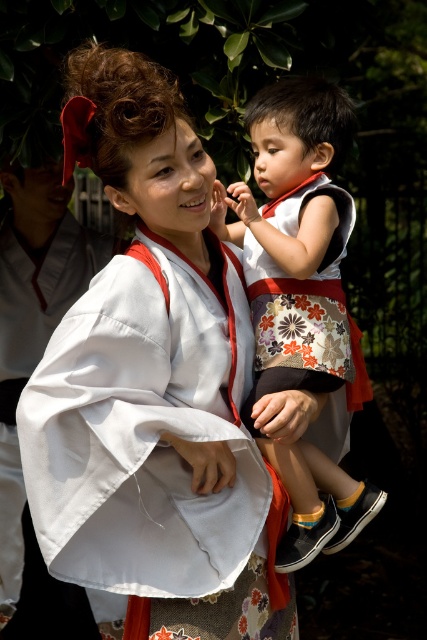
Does white silk kimono at center have a lesser width compared to white satin kimono at center?

No, white silk kimono at center is not thinner than white satin kimono at center.

Can you confirm if white silk kimono at center is wider than white satin kimono at center?

Indeed, white silk kimono at center has a greater width compared to white satin kimono at center.

You are a GUI agent. You are given a task and a screenshot of the screen. Output one action in this format:
    pyautogui.click(x=<x>, y=<y>)
    Task: Click on the white silk kimono at center
    The height and width of the screenshot is (640, 427).
    Given the screenshot: What is the action you would take?
    pyautogui.click(x=152, y=385)

In the scene shown: Is white silk kimono at center thinner than white cotton kimono at center?

Incorrect, white silk kimono at center's width is not less than white cotton kimono at center's.

Is white silk kimono at center further to the viewer compared to white cotton kimono at center?

No, white silk kimono at center is closer to the viewer.

Is point (67, 58) positioned behind point (298, 284)?

No, (67, 58) is in front of (298, 284).

The width and height of the screenshot is (427, 640). Find the location of `white silk kimono at center`. white silk kimono at center is located at coordinates (152, 385).

The image size is (427, 640). What do you see at coordinates (294, 236) in the screenshot?
I see `white cotton kimono at center` at bounding box center [294, 236].

Is point (342, 474) closer to camera compared to point (55, 300)?

Yes, it is.

This screenshot has width=427, height=640. I want to click on white cotton kimono at center, so click(x=294, y=236).